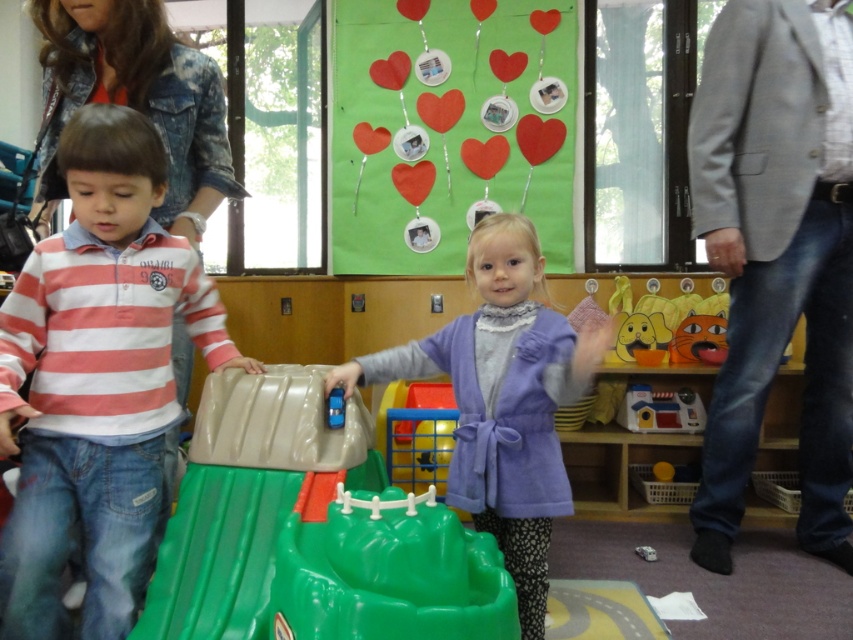
You are a teacher organizing a craft activity. You have two items to place on a shelf. The green paper heart at upper center and the matte plastic toy at right. If you want to arrange them vertically so the taller item is above the shorter one, which item should go on top?

The green paper heart at upper center is taller than the matte plastic toy at right, so it should be placed on top to follow the vertical arrangement requirement.